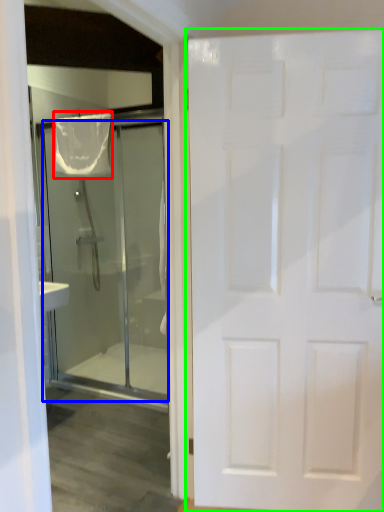
Question: Based on their relative distances, which object is nearer to shower curtain (highlighted by a red box)? Choose from door (highlighted by a blue box) and door (highlighted by a green box).

Choices:
 (A) door
 (B) door

Answer: (A)